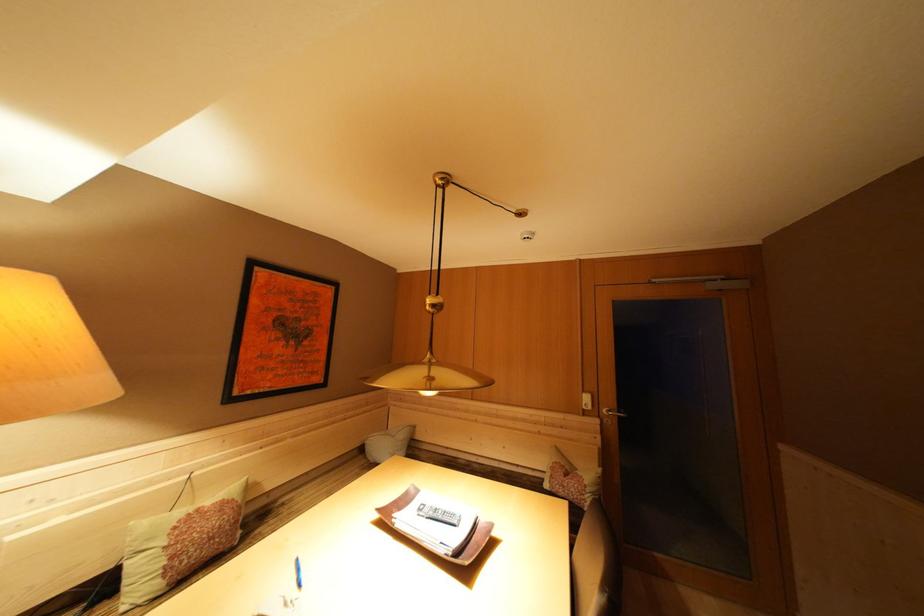
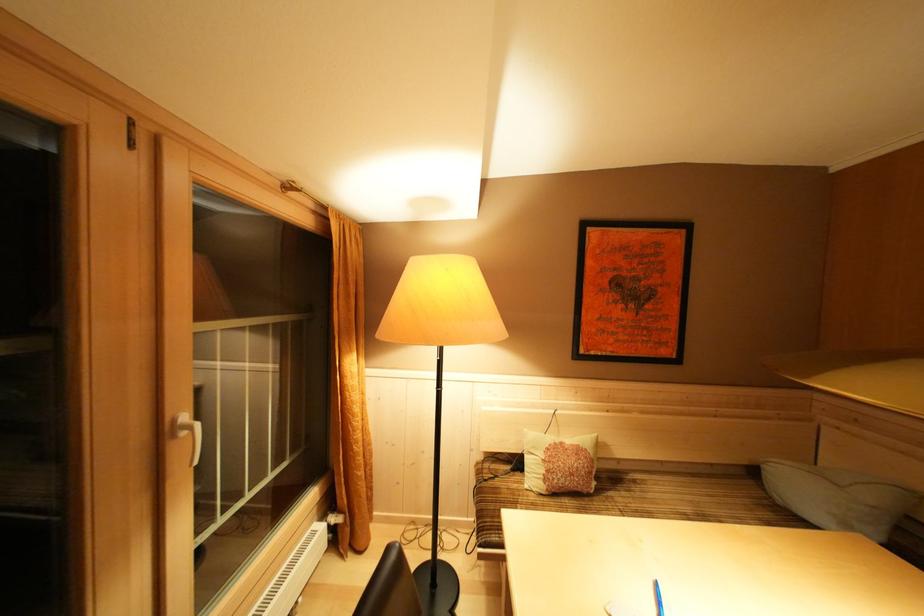
The point at (204, 515) is marked in the first image. Where is the corresponding point in the second image?

(568, 448)